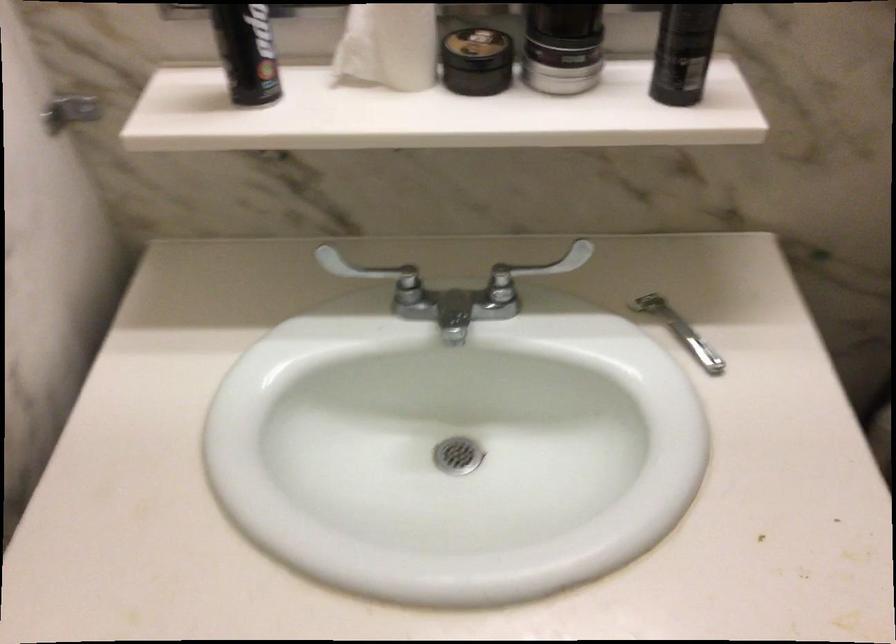
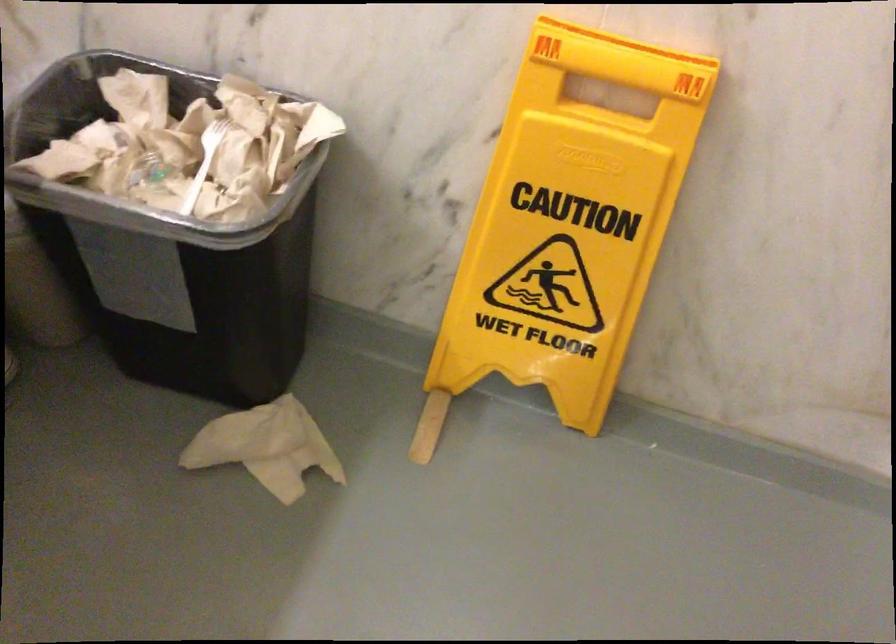
Based on the continuous images, in which direction is the camera rotating?

The camera's rotation is toward right-down.